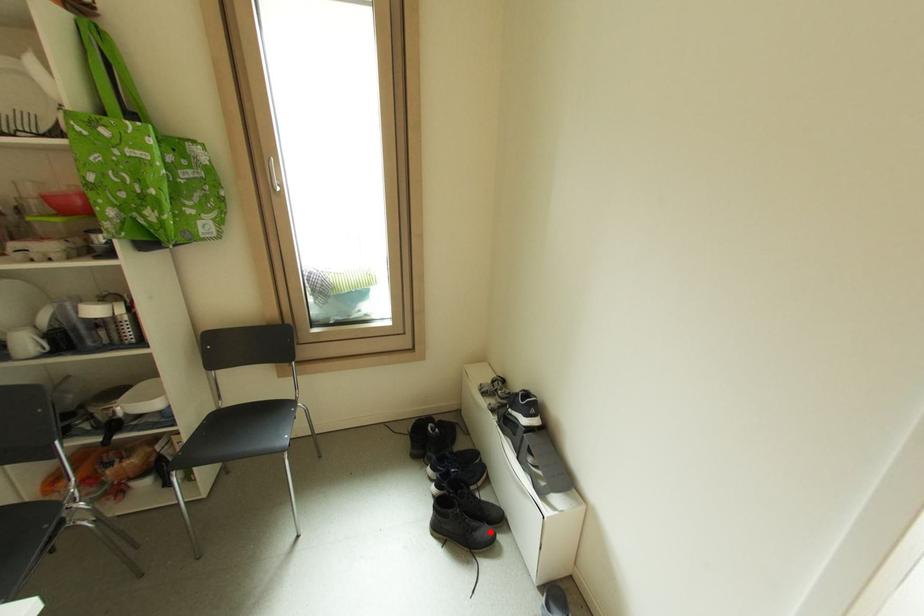
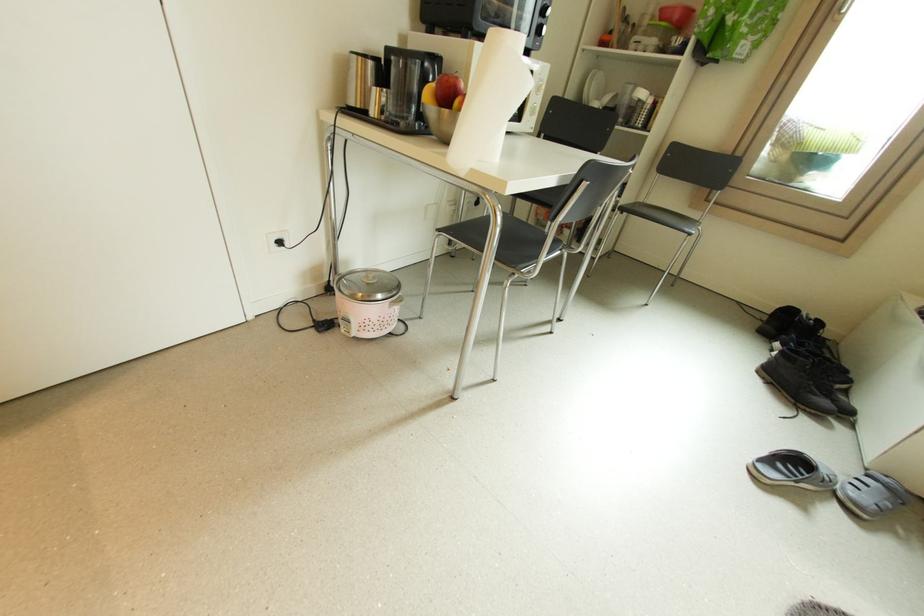
Question: I am providing you with two images of the same scene from different viewpoints. In image1, a red point is highlighted. Considering the same 3D point in image2, which of the following is correct?

Choices:
 (A) It is closer
 (B) It is farther

Answer: (B)